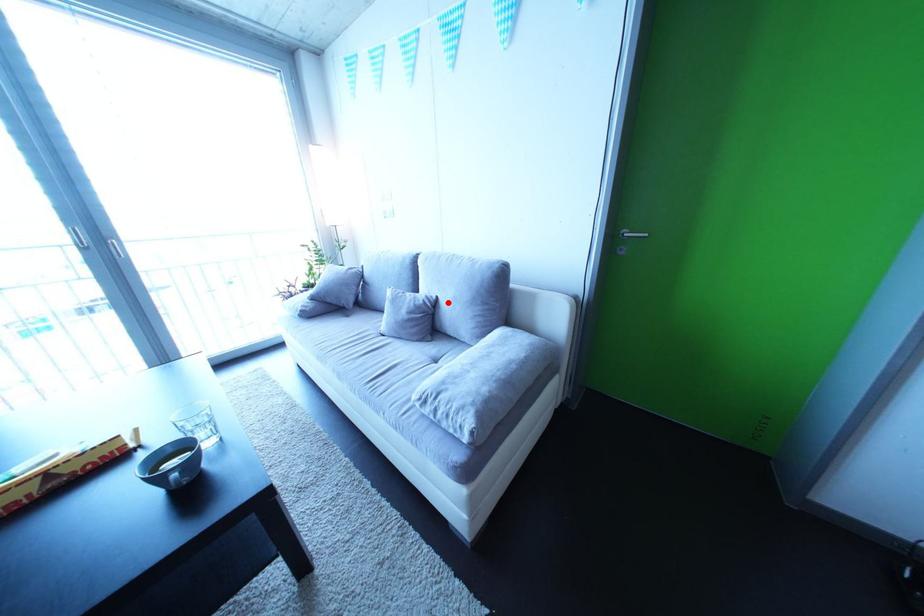
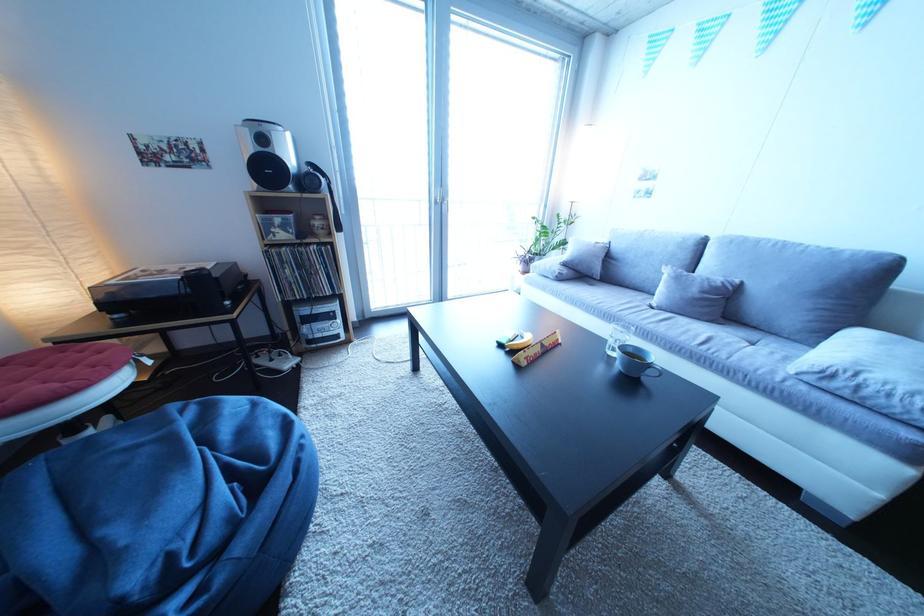
Find the pixel in the second image that matches the highlighted location in the first image.

(750, 286)